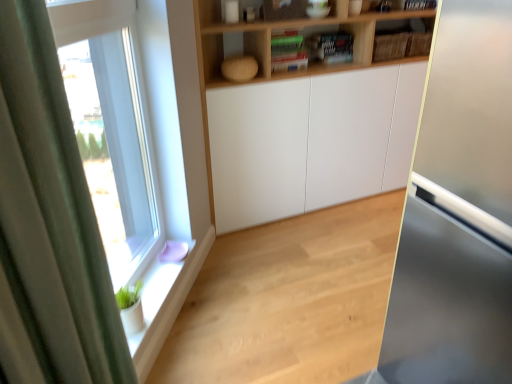
Question: Does wooden shelf at upper center have a greater width compared to green fabric curtain at left?

Choices:
 (A) yes
 (B) no

Answer: (A)

Question: Considering the relative sizes of wooden shelf at upper center and green fabric curtain at left in the image provided, is wooden shelf at upper center thinner than green fabric curtain at left?

Choices:
 (A) no
 (B) yes

Answer: (A)

Question: Is the depth of wooden shelf at upper center less than that of green fabric curtain at left?

Choices:
 (A) yes
 (B) no

Answer: (B)

Question: Is green fabric curtain at left surrounded by wooden shelf at upper center?

Choices:
 (A) no
 (B) yes

Answer: (A)

Question: Is wooden shelf at upper center bigger than green fabric curtain at left?

Choices:
 (A) yes
 (B) no

Answer: (A)

Question: Would you say green fabric curtain at left is inside or outside wooden shelf at upper center?

Choices:
 (A) outside
 (B) inside

Answer: (A)

Question: In terms of width, does green fabric curtain at left look wider or thinner when compared to wooden shelf at upper center?

Choices:
 (A) wide
 (B) thin

Answer: (B)

Question: Is green fabric curtain at left taller or shorter than wooden shelf at upper center?

Choices:
 (A) short
 (B) tall

Answer: (B)

Question: From the image's perspective, is green fabric curtain at left above or below wooden shelf at upper center?

Choices:
 (A) below
 (B) above

Answer: (A)

Question: Relative to white glossy window sill at lower left, is clear glass window at left in front or behind?

Choices:
 (A) front
 (B) behind

Answer: (A)

Question: Considering the positions of clear glass window at left and white glossy window sill at lower left in the image, is clear glass window at left wider or thinner than white glossy window sill at lower left?

Choices:
 (A) thin
 (B) wide

Answer: (B)

Question: From a real-world perspective, relative to white glossy window sill at lower left, is clear glass window at left vertically above or below?

Choices:
 (A) above
 (B) below

Answer: (A)

Question: Considering the positions of clear glass window at left and white glossy window sill at lower left in the image, is clear glass window at left bigger or smaller than white glossy window sill at lower left?

Choices:
 (A) small
 (B) big

Answer: (B)

Question: Is green fabric curtain at left situated inside natural wood floor at lower left or outside?

Choices:
 (A) outside
 (B) inside

Answer: (A)

Question: Does point (55, 155) appear closer or farther from the camera than point (361, 357)?

Choices:
 (A) closer
 (B) farther

Answer: (A)